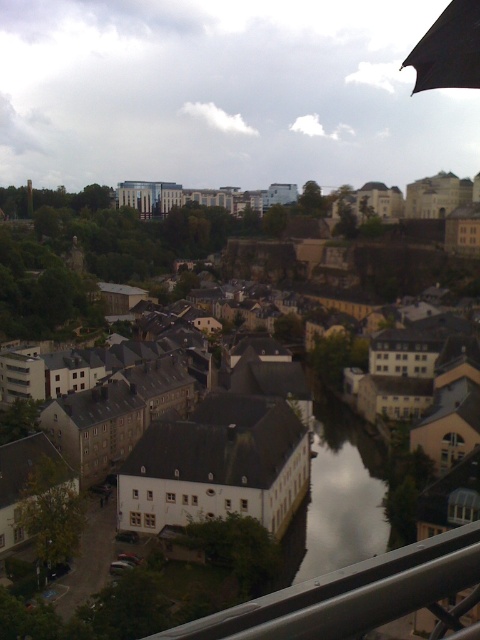
You are a tourist standing at the edge of the river in the town. You see the light beige stone buildings at center and the black matte umbrella at upper right. Which of these two objects is located to the right of the other?

The black matte umbrella at upper right is located to the right of the light beige stone buildings at center because the light beige stone buildings at center is positioned on the left side of black matte umbrella at upper right.

You are standing at the point marked as point (351, 595) in the image. What object is directly in front of you?

The silver metallic rail at lower center is directly in front of you at point (351, 595).

You are standing at the center of the town and want to reach the river. Which direction should you head to avoid the light beige stone buildings at center?

The light beige stone buildings at center are located at point [338,492], so you should head towards the river by moving away from that coordinate to avoid them.